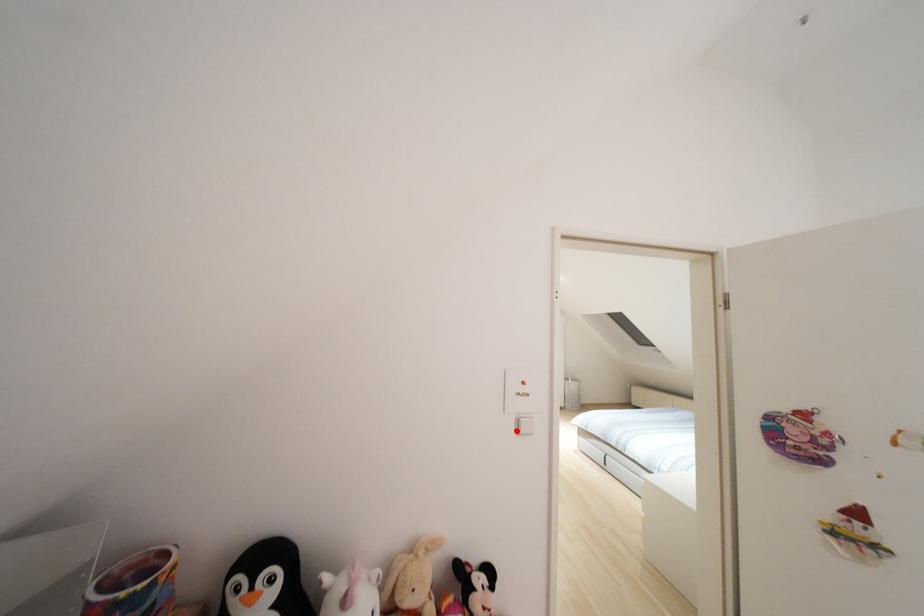
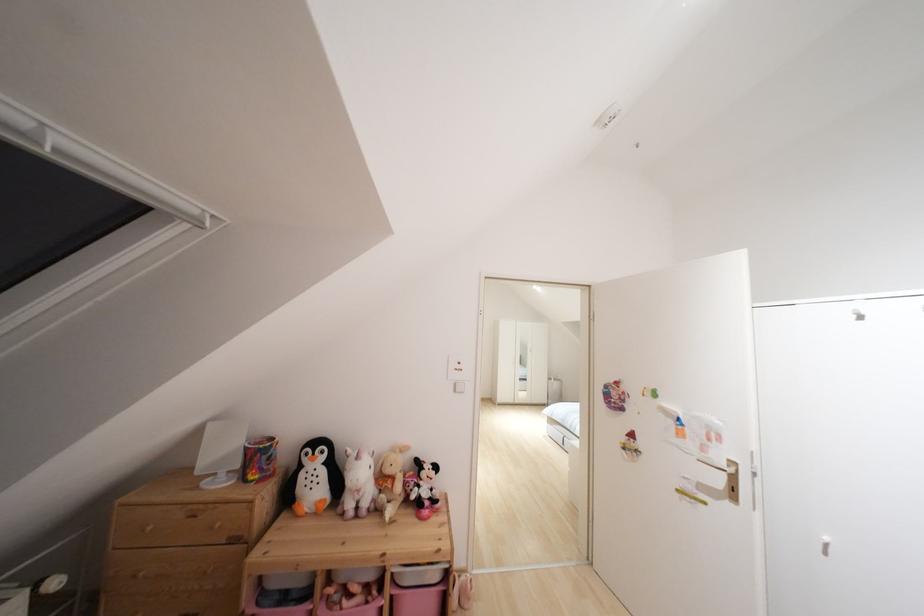
Question: I am providing you with two images of the same scene from different viewpoints. A red point is marked on the first image. Is the red point's position out of view in image 2?

Choices:
 (A) Yes
 (B) No

Answer: (B)